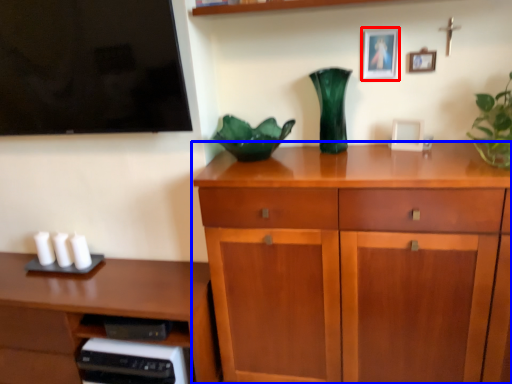
Question: Which of the following is the closest to the observer, picture frame (highlighted by a red box) or chest of drawers (highlighted by a blue box)?

Choices:
 (A) picture frame
 (B) chest of drawers

Answer: (B)